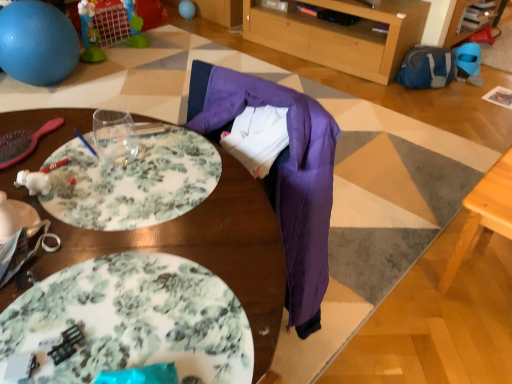
The image size is (512, 384). I want to click on unoccupied space behind light wood table at lower right, marked as the 2th table in a left-to-right arrangement, so click(424, 197).